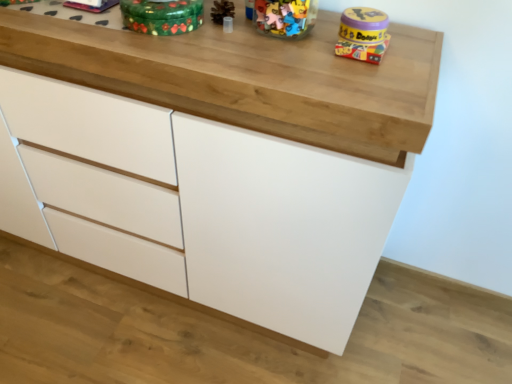
Find the location of a particular element. This screenshot has height=384, width=512. vacant area that is situated to the right of matte yellow plastic toy at upper right, the first toy when ordered from right to left is located at coordinates (414, 42).